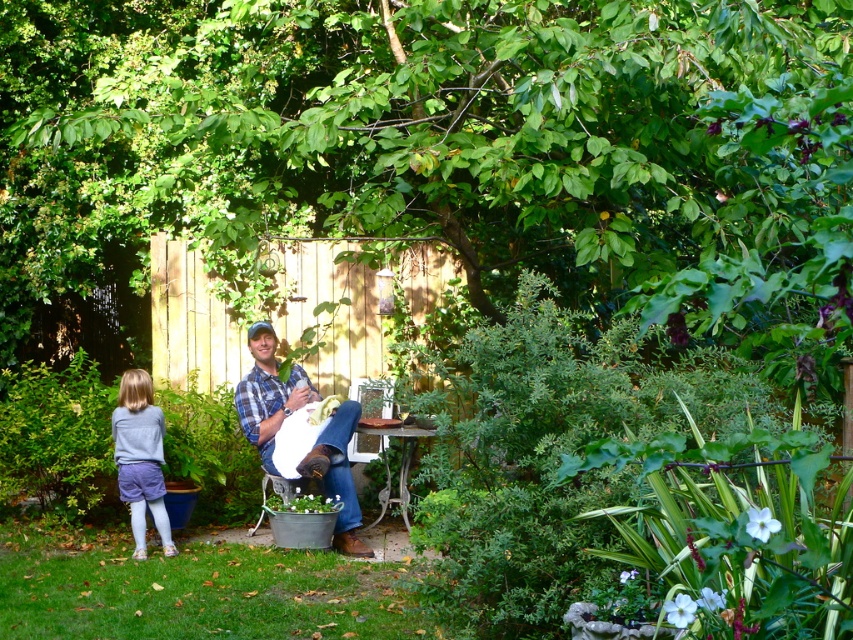
Question: Does plaid shirt at center appear over light gray cotton sweater at lower left?

Choices:
 (A) yes
 (B) no

Answer: (A)

Question: Can you confirm if light gray cotton sweater at lower left is positioned to the right of metallic silver table at center?

Choices:
 (A) no
 (B) yes

Answer: (A)

Question: Does plaid shirt at center appear over metallic silver table at center?

Choices:
 (A) yes
 (B) no

Answer: (A)

Question: Estimate the real-world distances between objects in this image. Which object is closer to the light gray cotton sweater at lower left?

Choices:
 (A) metallic silver table at center
 (B) plaid shirt at center

Answer: (B)

Question: Which object is the closest to the metallic silver table at center?

Choices:
 (A) plaid shirt at center
 (B) light gray cotton sweater at lower left

Answer: (A)

Question: Which of these objects is positioned closest to the light gray cotton sweater at lower left?

Choices:
 (A) metallic silver table at center
 (B) plaid shirt at center

Answer: (B)